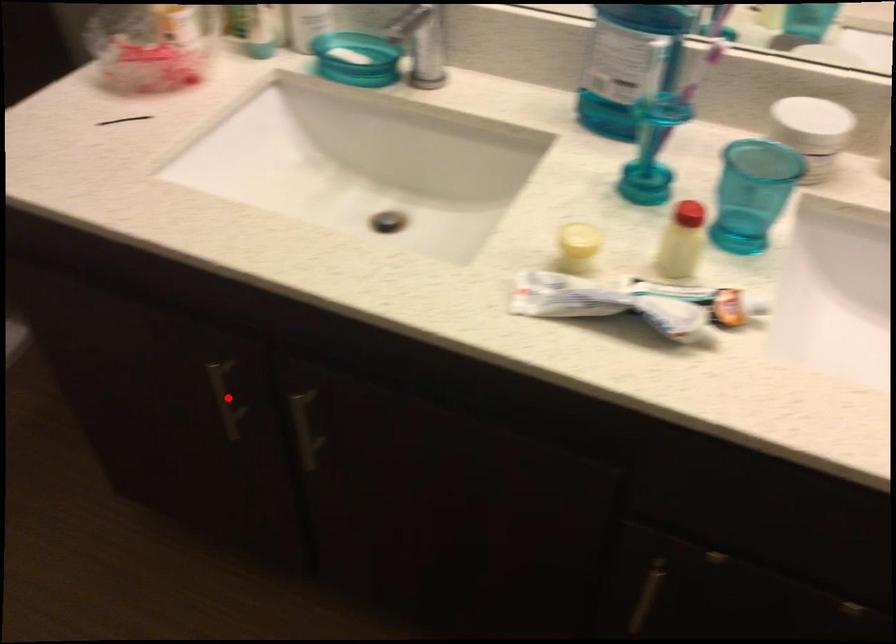
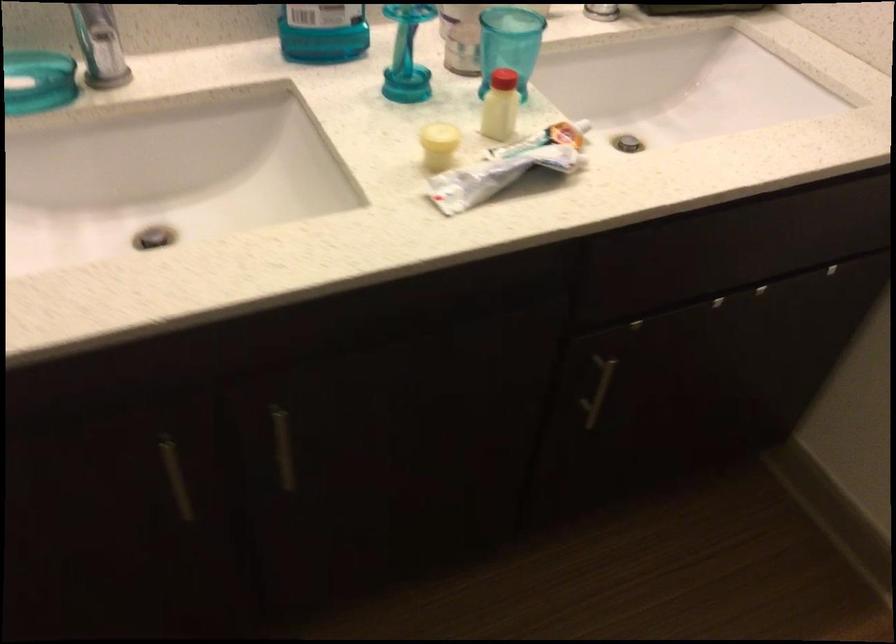
Question: I am providing you with two images of the same scene from different viewpoints. Given a red point in image1, look at the same physical point in image2. Is it:

Choices:
 (A) Closer to the viewpoint
 (B) Farther from the viewpoint

Answer: (A)